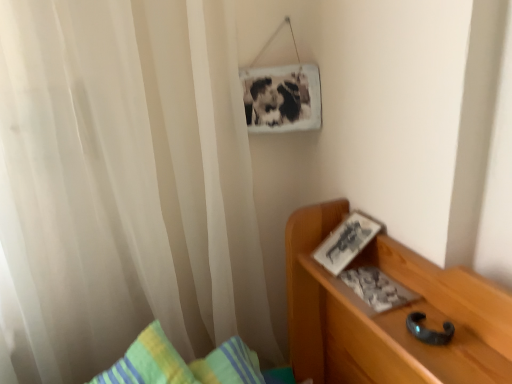
Question: From the image's perspective, relative to white sheer curtain at left, is white paper book at right above or below?

Choices:
 (A) below
 (B) above

Answer: (A)

Question: Is white paper book at right inside the boundaries of white sheer curtain at left, or outside?

Choices:
 (A) inside
 (B) outside

Answer: (B)

Question: Considering the positions of white paper book at right and white sheer curtain at left in the image, is white paper book at right bigger or smaller than white sheer curtain at left?

Choices:
 (A) small
 (B) big

Answer: (A)

Question: Which is correct: white sheer curtain at left is inside white paper book at right, or outside of it?

Choices:
 (A) outside
 (B) inside

Answer: (A)

Question: Is point (88, 56) closer or farther from the camera than point (393, 281)?

Choices:
 (A) farther
 (B) closer

Answer: (B)

Question: Considering the relative positions of white sheer curtain at left and white paper book at right in the image provided, is white sheer curtain at left to the left or to the right of white paper book at right?

Choices:
 (A) right
 (B) left

Answer: (B)

Question: Is white sheer curtain at left taller or shorter than white paper book at right?

Choices:
 (A) short
 (B) tall

Answer: (B)